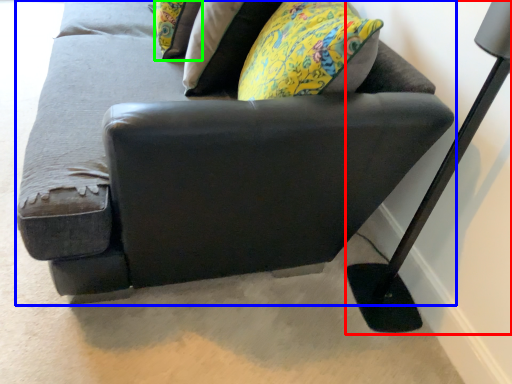
Question: Which object is positioned farthest from table lamp (highlighted by a red box)? Select from studio couch (highlighted by a blue box) and pillow (highlighted by a green box).

Choices:
 (A) studio couch
 (B) pillow

Answer: (B)